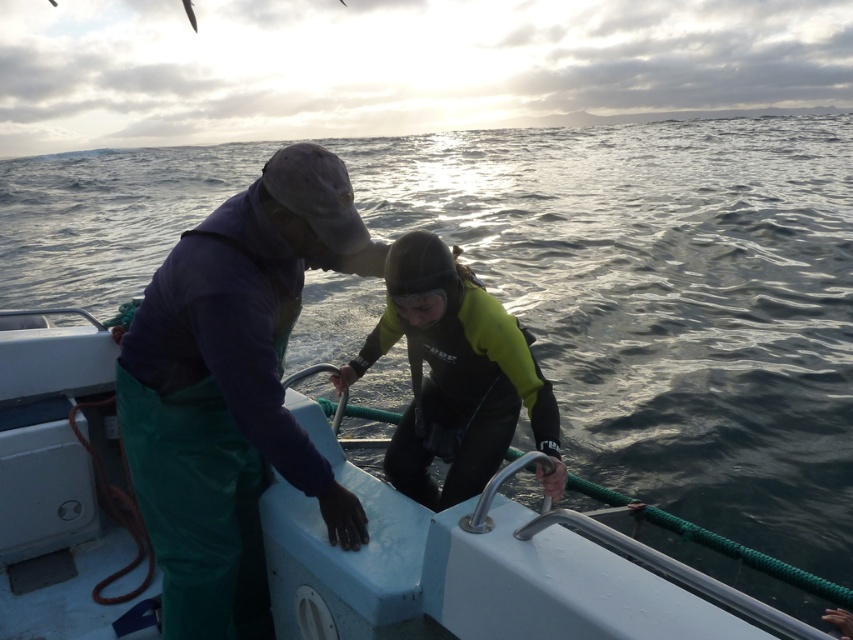
Question: Can you confirm if green fabric pants at left is positioned to the right of neoprene wetsuit at center?

Choices:
 (A) no
 (B) yes

Answer: (A)

Question: Is neoprene wetsuit at center to the left of shiny silver fish at upper left from the viewer's perspective?

Choices:
 (A) no
 (B) yes

Answer: (A)

Question: Which object is positioned closest to the shiny silver fish at upper left?

Choices:
 (A) white plastic boat at center
 (B) green fabric pants at left
 (C) neoprene wetsuit at center

Answer: (A)

Question: Which of the following is the farthest from the observer?

Choices:
 (A) shiny silver fish at upper left
 (B) neoprene wetsuit at center
 (C) green fabric pants at left
 (D) white plastic boat at center

Answer: (A)

Question: Which of these objects is positioned farthest from the neoprene wetsuit at center?

Choices:
 (A) green fabric pants at left
 (B) white plastic boat at center
 (C) shiny silver fish at upper left

Answer: (C)

Question: Can you confirm if white plastic boat at center is positioned above neoprene wetsuit at center?

Choices:
 (A) no
 (B) yes

Answer: (A)